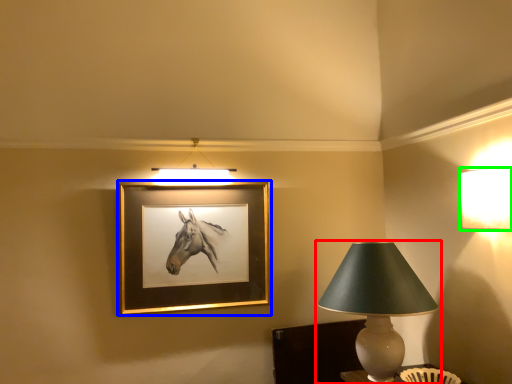
Question: Based on their relative distances, which object is nearer to lamp (highlighted by a red box)? Choose from picture frame (highlighted by a blue box) and lamp (highlighted by a green box).

Choices:
 (A) picture frame
 (B) lamp

Answer: (B)